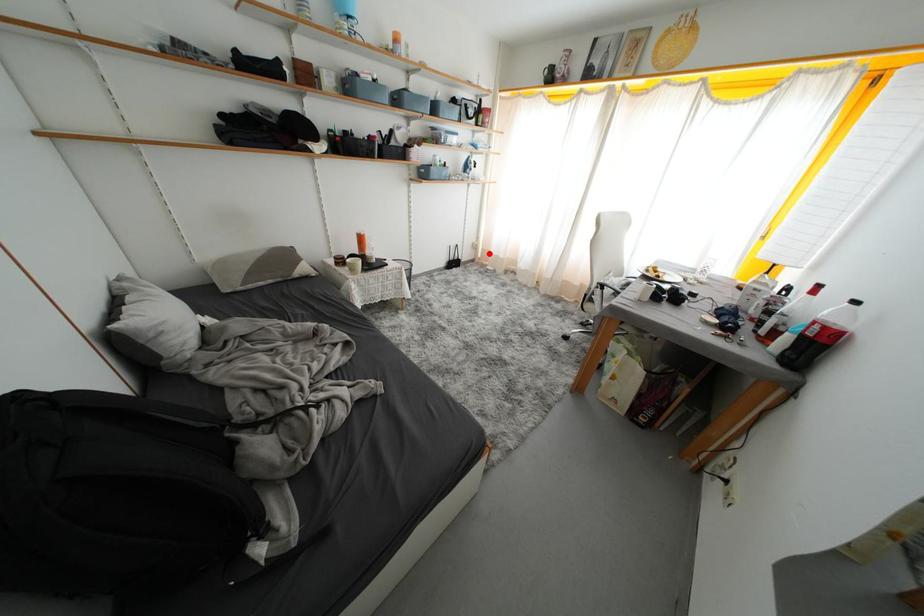
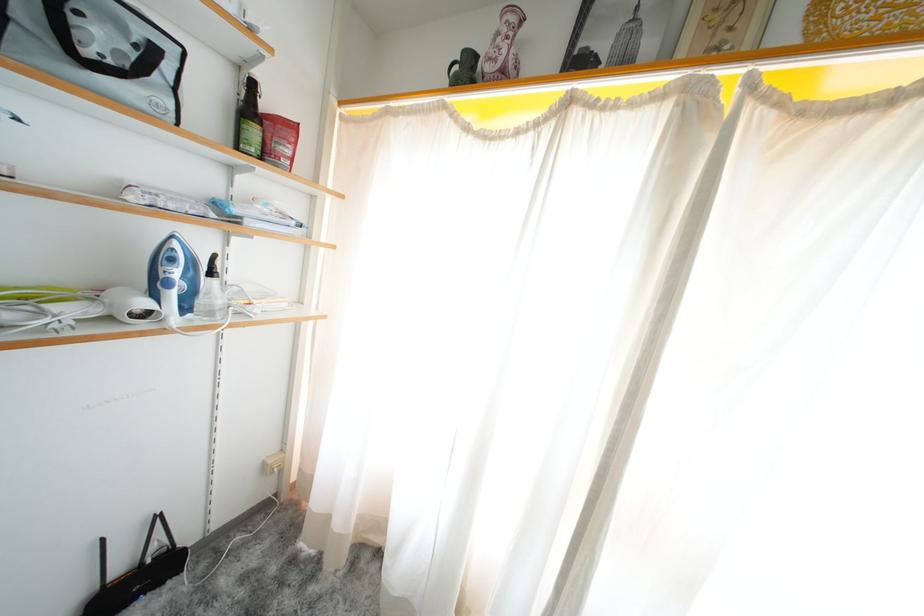
Question: I am providing you with two images of the same scene from different viewpoints. A red point is marked on the first image. Can you still see the location of the red point in image 2?

Choices:
 (A) Yes
 (B) No

Answer: (A)